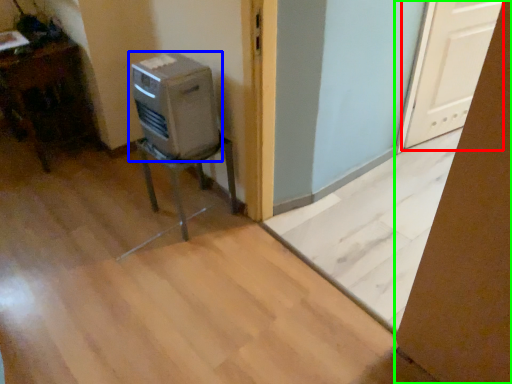
Question: Which object is the closest to the screen door (highlighted by a red box)? Choose among these: home appliance (highlighted by a blue box) or cardboard box (highlighted by a green box).

Choices:
 (A) home appliance
 (B) cardboard box

Answer: (A)